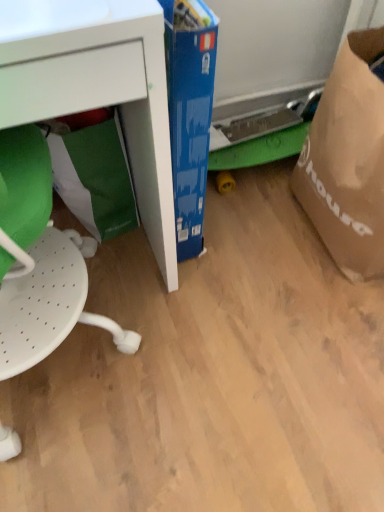
I want to click on free space that is in between white matte desk at lower left and white perforated swivel chair at left, so click(161, 333).